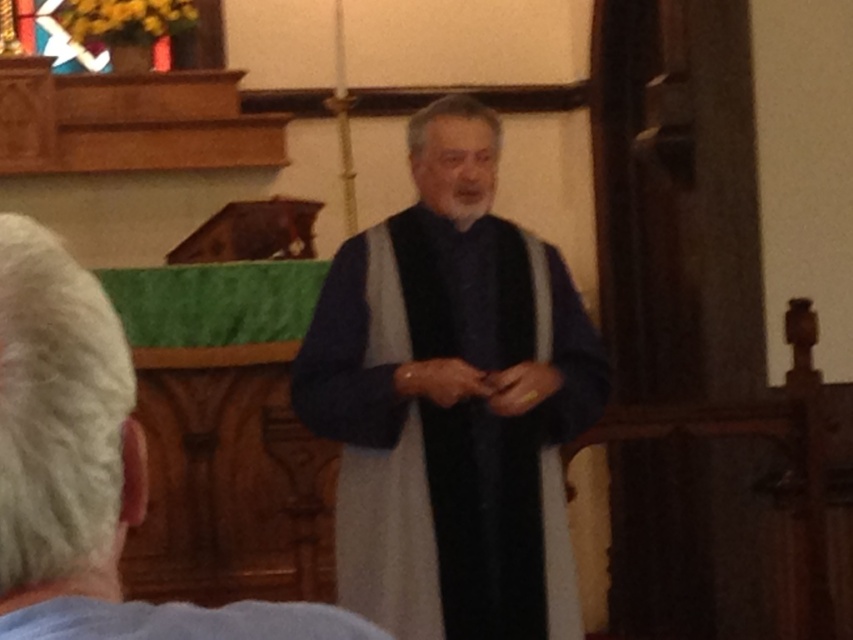
You are standing in the church scene and want to determine which of the two points, point (381, 276) or point (140, 637), is closer to you. Based on the description, which point is nearer to your current position?

Point (140, 637) is closer to you because it is stated that point (381, 276) is further to the camera than point (140, 637).

You are standing in the church and want to approach the altar. Which object, the velvet blue robe at center or the dark blue fabric at center, would you encounter first as you move forward?

The velvet blue robe at center is closer to you than the dark blue fabric at center, so you would encounter the velvet blue robe at center first.